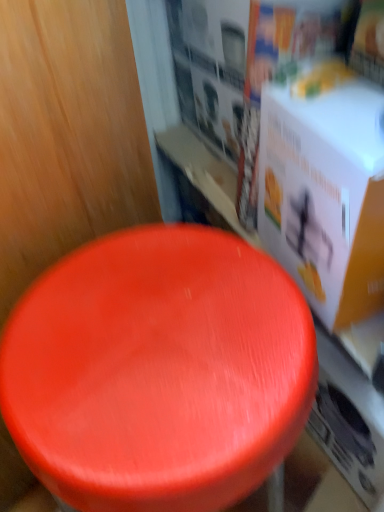
Question: Can you confirm if white cardboard box at upper right is shorter than shiny red stool at center?

Choices:
 (A) yes
 (B) no

Answer: (A)

Question: Can you confirm if white cardboard box at upper right is bigger than shiny red stool at center?

Choices:
 (A) yes
 (B) no

Answer: (B)

Question: From a real-world perspective, is white cardboard box at upper right physically above shiny red stool at center?

Choices:
 (A) no
 (B) yes

Answer: (B)

Question: Does white cardboard box at upper right have a smaller size compared to shiny red stool at center?

Choices:
 (A) no
 (B) yes

Answer: (B)

Question: Can shiny red stool at center be found inside white cardboard box at upper right?

Choices:
 (A) yes
 (B) no

Answer: (B)

Question: Is white cardboard box at upper right not near shiny red stool at center?

Choices:
 (A) yes
 (B) no

Answer: (B)

Question: Would you say shiny red stool at center is a long distance from white cardboard box at upper right?

Choices:
 (A) yes
 (B) no

Answer: (B)

Question: Would you say white cardboard box at upper right is part of shiny red stool at center's contents?

Choices:
 (A) yes
 (B) no

Answer: (B)

Question: Does shiny red stool at center lie behind white cardboard box at upper right?

Choices:
 (A) yes
 (B) no

Answer: (B)

Question: From a real-world perspective, is shiny red stool at center located beneath white cardboard box at upper right?

Choices:
 (A) no
 (B) yes

Answer: (B)

Question: Considering the relative sizes of shiny red stool at center and white cardboard box at upper right in the image provided, is shiny red stool at center shorter than white cardboard box at upper right?

Choices:
 (A) no
 (B) yes

Answer: (A)

Question: Can you confirm if shiny red stool at center is thinner than white cardboard box at upper right?

Choices:
 (A) no
 (B) yes

Answer: (A)

Question: From a real-world perspective, is shiny red stool at center above or below white cardboard box at upper right?

Choices:
 (A) above
 (B) below

Answer: (B)